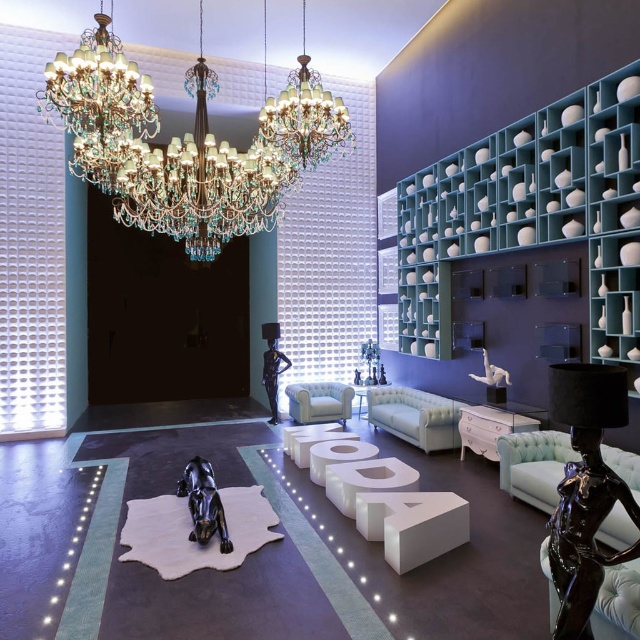
Question: Which point is farther from the camera taking this photo?

Choices:
 (A) (540, 432)
 (B) (468, 374)

Answer: (B)

Question: Is white leather couch at center smaller than light blue fabric armchair at center?

Choices:
 (A) yes
 (B) no

Answer: (B)

Question: In this image, where is white leather couch at center located relative to white glossy sculpture at center?

Choices:
 (A) right
 (B) left

Answer: (B)

Question: Among these points, which one is farthest from the camera?

Choices:
 (A) (456, 404)
 (B) (276, 145)
 (C) (554, 468)

Answer: (A)

Question: Does white leather rug at center have a lesser width compared to white leather couch at center?

Choices:
 (A) no
 (B) yes

Answer: (A)

Question: Estimate the real-world distances between objects in this image. Which object is farther from the black glossy sculpture at center?

Choices:
 (A) white leather couch at center
 (B) black glossy statue at center
 (C) light blue fabric armchair at center

Answer: (B)